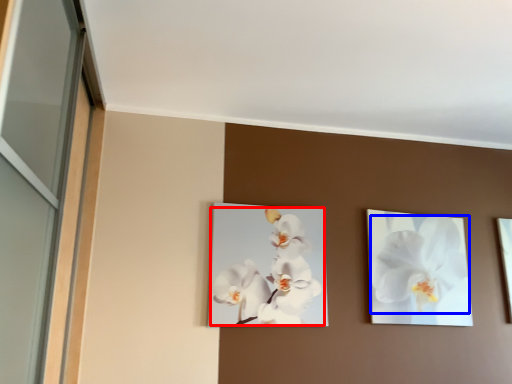
Question: Among these objects, which one is nearest to the camera, flower (highlighted by a red box) or flower (highlighted by a blue box)?

Choices:
 (A) flower
 (B) flower

Answer: (A)